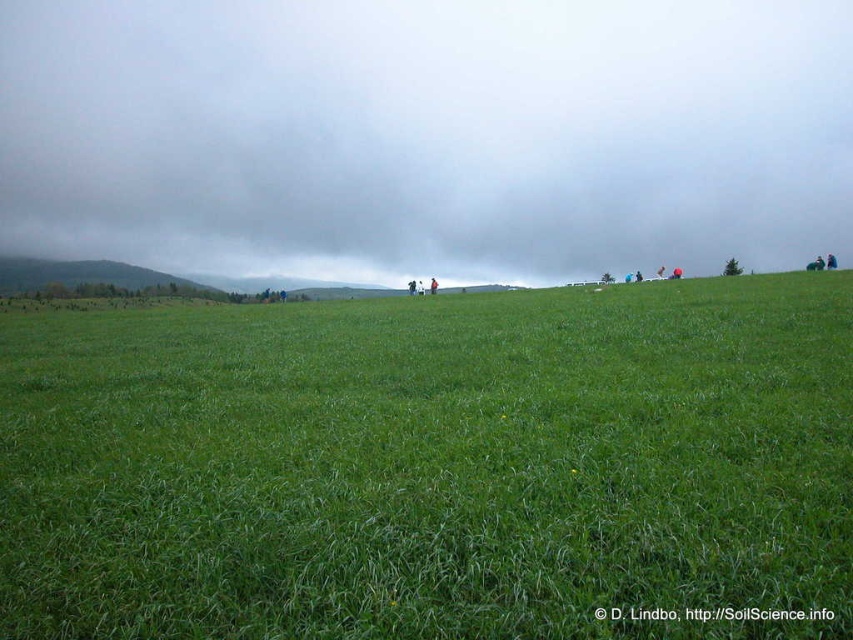
Question: Is green grassy field at center to the left of gray cloudy sky at upper center from the viewer's perspective?

Choices:
 (A) no
 (B) yes

Answer: (A)

Question: Which of the following is the closest to the observer?

Choices:
 (A) green grassy field at center
 (B) gray cloudy sky at upper center

Answer: (A)

Question: Among these objects, which one is farthest from the camera?

Choices:
 (A) green grassy field at center
 (B) gray cloudy sky at upper center

Answer: (B)

Question: Is green grassy field at center thinner than gray cloudy sky at upper center?

Choices:
 (A) no
 (B) yes

Answer: (B)

Question: Is green grassy field at center to the right of gray cloudy sky at upper center from the viewer's perspective?

Choices:
 (A) no
 (B) yes

Answer: (B)